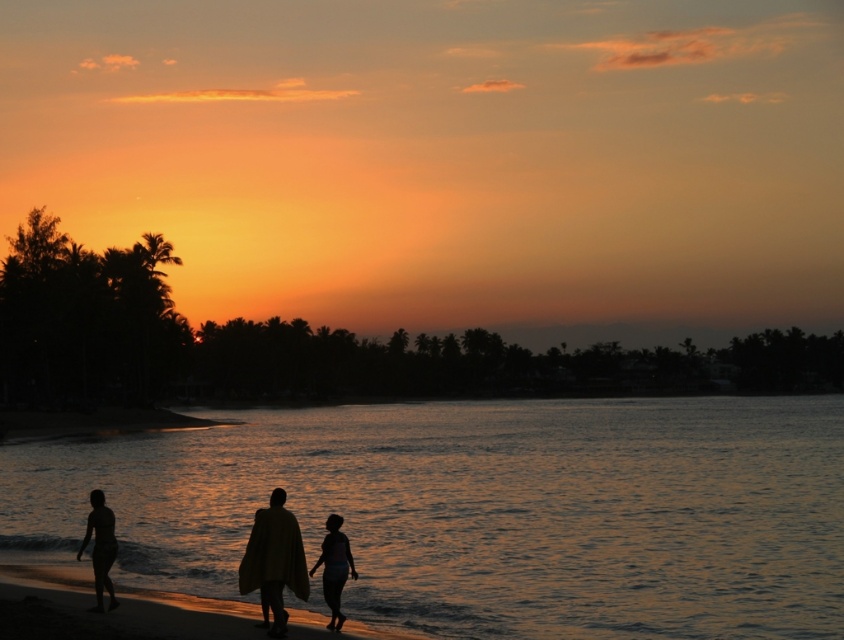
Consider the image. You are standing on the beach and see the glistening water at lower center and the silhouette figure at lower center. Which object is closer to the ground?

The glistening water at lower center is positioned under the silhouette figure at lower center, so it is closer to the ground.

You are standing on the beach and notice the glistening water at lower center and the silhouette figure at lower center. Which object appears taller in the scene?

Answer: The glistening water at lower center appears taller than the silhouette figure at lower center.

You are a photographer standing on the beach and want to capture both the silhouette skin at lower left and the silhouette figure at lower center in the same frame. Your camera has a maximum focus range of 4 meters. Can you fit both subjects into the frame without moving closer?

The silhouette skin at lower left and silhouette figure at lower center are 3.90 meters apart from each other. Since the distance between them is within the camera maximum focus range of 4 meters, you can fit both subjects into the frame without moving closer.